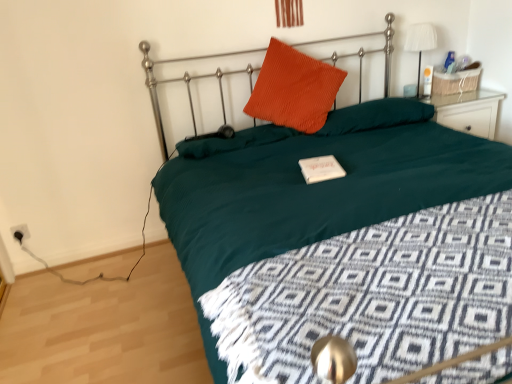
Question: Which direction should I rotate to look at orange corduroy pillow at center, the 3th pillow viewed from the right, — up or down?

Choices:
 (A) down
 (B) up

Answer: (B)

Question: Considering the relative sizes of white fabric lampshade at upper right and teal fabric bed at center in the image provided, is white fabric lampshade at upper right shorter than teal fabric bed at center?

Choices:
 (A) no
 (B) yes

Answer: (B)

Question: From a real-world perspective, is white fabric lampshade at upper right located beneath teal fabric bed at center?

Choices:
 (A) no
 (B) yes

Answer: (A)

Question: Is white fabric lampshade at upper right thinner than teal fabric bed at center?

Choices:
 (A) yes
 (B) no

Answer: (A)

Question: Could teal fabric bed at center be considered to be inside white fabric lampshade at upper right?

Choices:
 (A) yes
 (B) no

Answer: (B)

Question: Is white fabric lampshade at upper right positioned before teal fabric bed at center?

Choices:
 (A) yes
 (B) no

Answer: (B)

Question: Is white fabric lampshade at upper right not within teal fabric bed at center?

Choices:
 (A) no
 (B) yes

Answer: (B)

Question: Is corduroy orange pillow at center, the second pillow from the right, located outside orange corduroy pillow at upper center, the 3th pillow in the left-to-right sequence?

Choices:
 (A) no
 (B) yes

Answer: (B)

Question: Is corduroy orange pillow at center, positioned as the 2th pillow in left-to-right order, at the right side of orange corduroy pillow at upper center, the 3th pillow in the left-to-right sequence?

Choices:
 (A) yes
 (B) no

Answer: (B)

Question: From the image's perspective, is corduroy orange pillow at center, the second pillow from the right, under orange corduroy pillow at upper center, the 1th pillow positioned from the right?

Choices:
 (A) yes
 (B) no

Answer: (B)

Question: Are corduroy orange pillow at center, positioned as the 2th pillow in left-to-right order, and orange corduroy pillow at upper center, the 1th pillow positioned from the right, making contact?

Choices:
 (A) no
 (B) yes

Answer: (A)

Question: Considering the relative positions of corduroy orange pillow at center, positioned as the 2th pillow in left-to-right order, and orange corduroy pillow at upper center, the 3th pillow in the left-to-right sequence, in the image provided, is corduroy orange pillow at center, positioned as the 2th pillow in left-to-right order, behind orange corduroy pillow at upper center, the 3th pillow in the left-to-right sequence,?

Choices:
 (A) yes
 (B) no

Answer: (B)

Question: Can you confirm if corduroy orange pillow at center, positioned as the 2th pillow in left-to-right order, is shorter than orange corduroy pillow at upper center, the 3th pillow in the left-to-right sequence?

Choices:
 (A) no
 (B) yes

Answer: (A)

Question: From the image's perspective, would you say corduroy orange pillow at center, the second pillow from the right, is shown under black plastic socket at lower left?

Choices:
 (A) yes
 (B) no

Answer: (B)